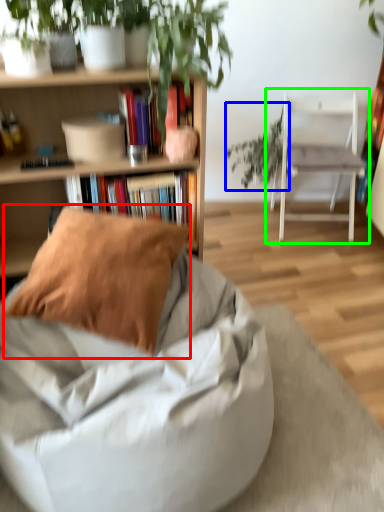
Question: Estimate the real-world distances between objects in this image. Which object is closer to pillow (highlighted by a red box), vegetation (highlighted by a blue box) or chair (highlighted by a green box)?

Choices:
 (A) vegetation
 (B) chair

Answer: (B)